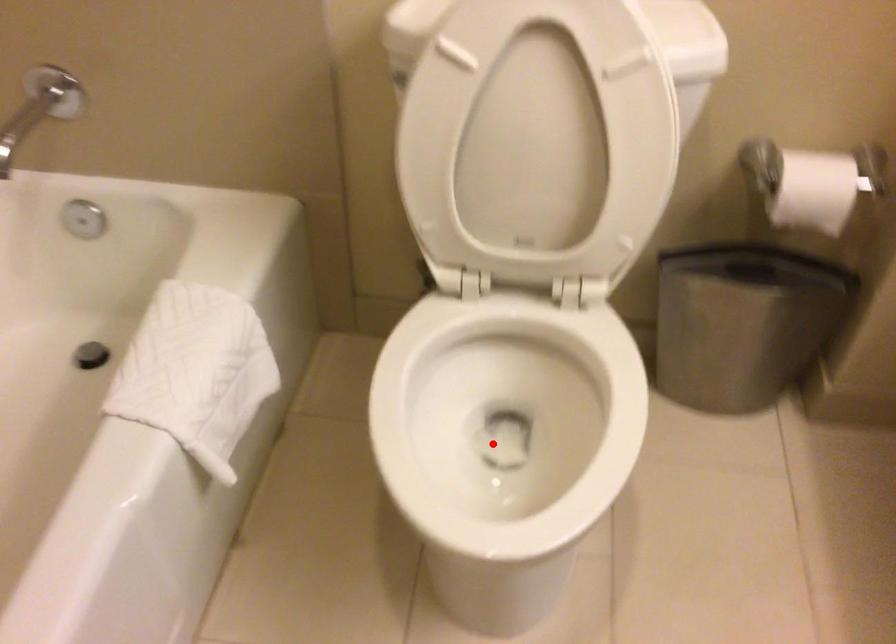
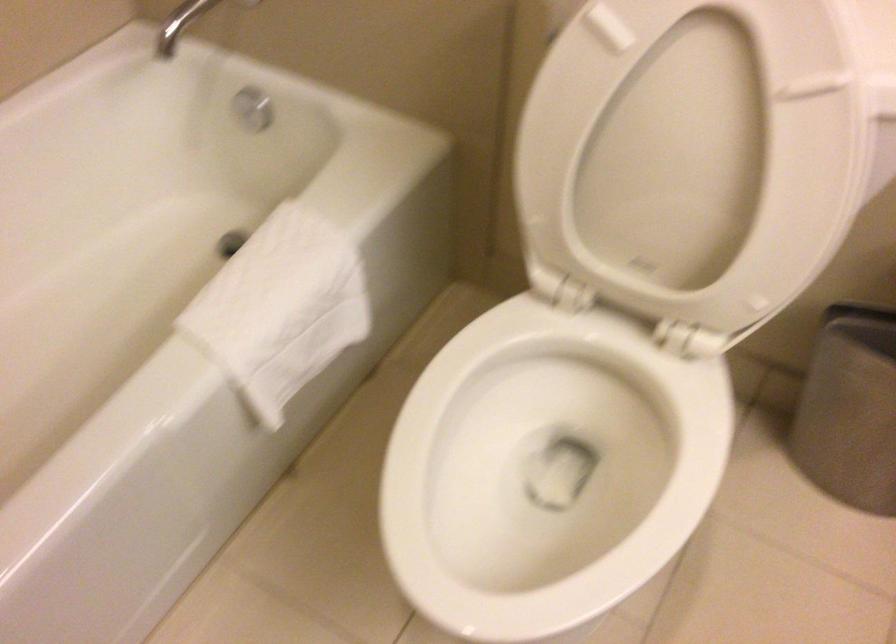
Locate, in the second image, the point that corresponds to the highlighted location in the first image.

(547, 469)